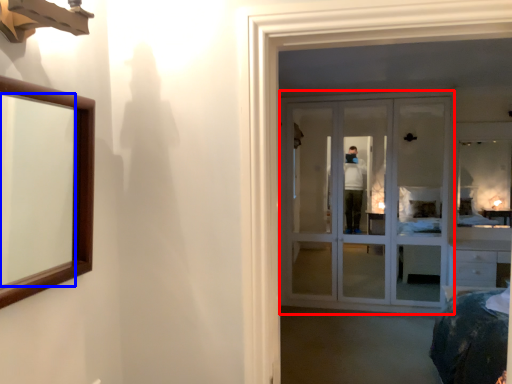
Question: Which point is closer to the camera, door (highlighted by a red box) or mirror (highlighted by a blue box)?

Choices:
 (A) door
 (B) mirror

Answer: (B)